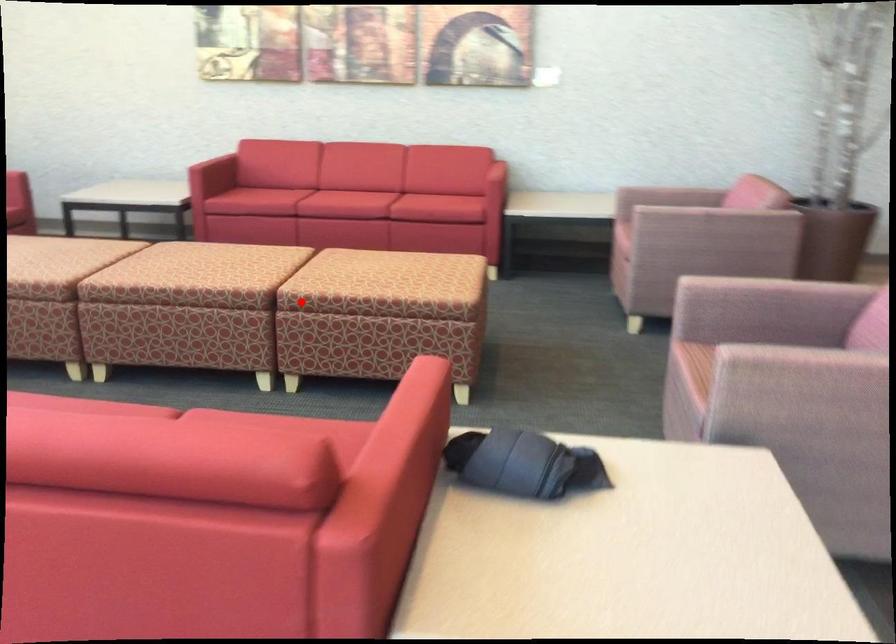
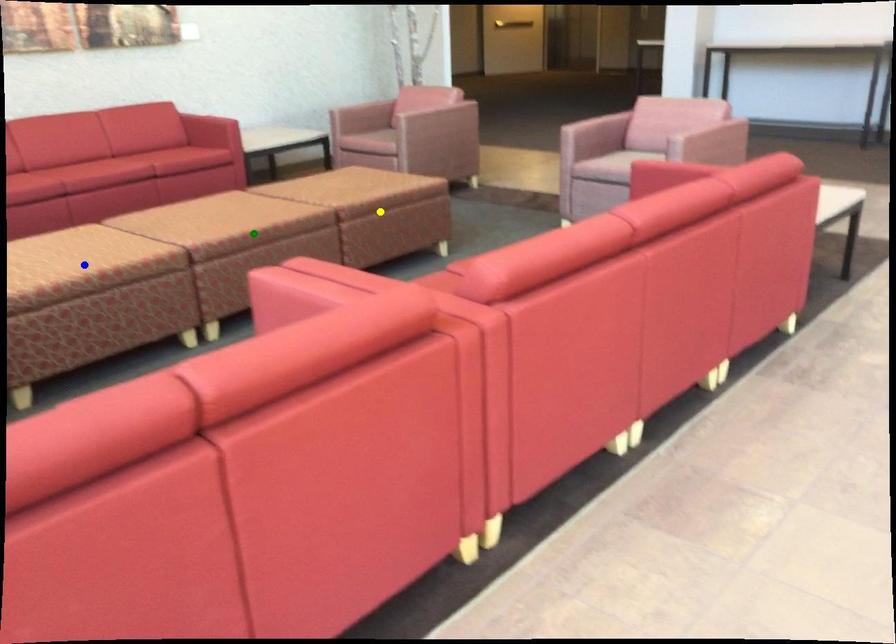
Question: I am providing you with two images of the same scene from different viewpoints. A red point is marked on the first image. You are given multiple points on the second image. Which mark in image 2 goes with the point in image 1?

Choices:
 (A) yellow point
 (B) blue point
 (C) green point

Answer: (A)